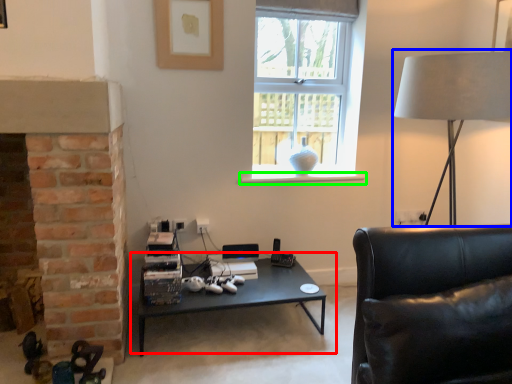
Question: Considering the real-world distances, which object is farthest from coffee table (highlighted by a red box)? table lamp (highlighted by a blue box) or window sill (highlighted by a green box)?

Choices:
 (A) table lamp
 (B) window sill

Answer: (A)